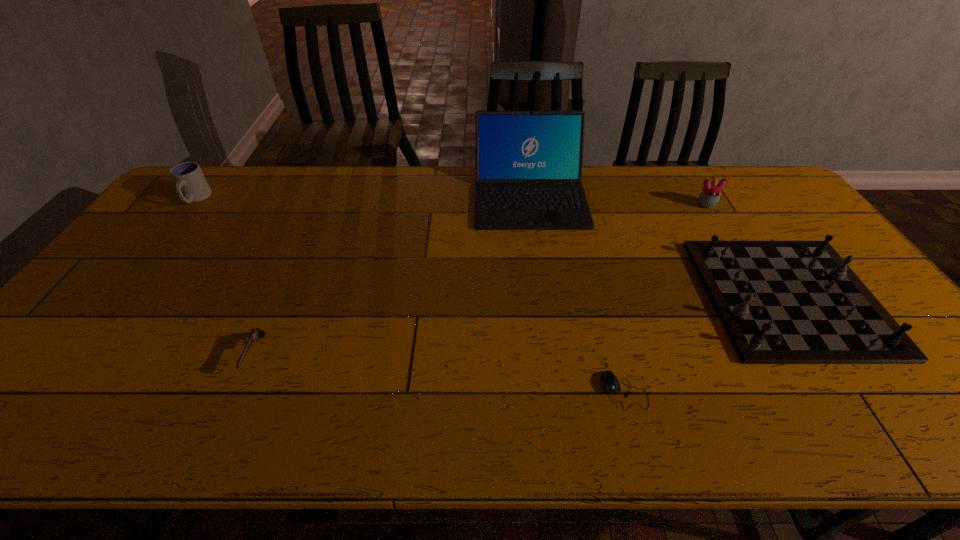
You are a GUI agent. You are given a task and a screenshot of the screen. Output one action in this format:
    pyautogui.click(x=<x>, y=<y>)
    Task: Click on the object at the right edge
    This screenshot has width=960, height=540.
    Given the screenshot: What is the action you would take?
    pyautogui.click(x=781, y=302)

Find the location of a particular element. Image resolution: width=960 pixels, height=540 pixels. object that is at the far left corner is located at coordinates (191, 184).

This screenshot has width=960, height=540. I want to click on free spot at the far edge of the desktop, so click(341, 173).

This screenshot has height=540, width=960. I want to click on vacant position at the near edge of the desktop, so click(x=344, y=416).

In the image, there is a desktop. Identify the location of blank space at the left edge. This screenshot has width=960, height=540. (115, 343).

At what (x,y) coordinates should I click in order to perform the action: click on free space at the right edge of the desktop. Please return your answer as a coordinate pair (x, y). This screenshot has width=960, height=540. Looking at the image, I should click on (904, 401).

Image resolution: width=960 pixels, height=540 pixels. Find the location of `blank region between the computer mouse and the cupcake`. blank region between the computer mouse and the cupcake is located at coordinates (665, 298).

Find the location of a particular element. This screenshot has height=540, width=960. unoccupied area between the cup and the laptop computer is located at coordinates (363, 198).

Identify the location of free spot between the fourth tallest object and the leftmost object. click(492, 248).

The height and width of the screenshot is (540, 960). I want to click on free space that is in between the pistol and the tallest object, so click(x=393, y=275).